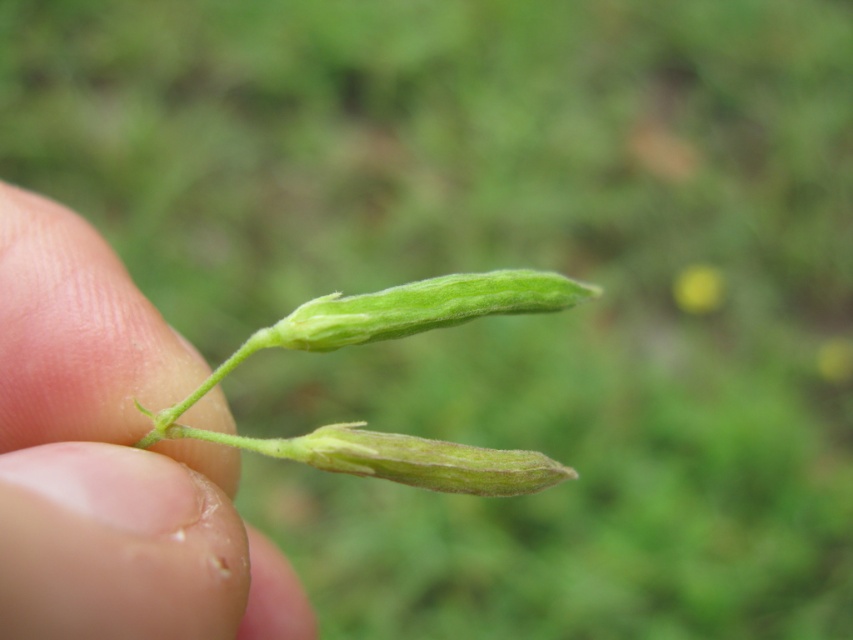
Question: Is green matte pod at center to the right of green matte pod at upper center from the viewer's perspective?

Choices:
 (A) yes
 (B) no

Answer: (B)

Question: Does green matte pod at center have a greater width compared to green matte pod at upper center?

Choices:
 (A) yes
 (B) no

Answer: (A)

Question: Among these objects, which one is nearest to the camera?

Choices:
 (A) green matte pod at upper center
 (B) green matte pod at center

Answer: (B)

Question: Does green matte pod at center have a lesser width compared to green matte pod at upper center?

Choices:
 (A) yes
 (B) no

Answer: (B)

Question: Which of the following is the farthest from the observer?

Choices:
 (A) green matte pod at center
 (B) green matte pod at upper center

Answer: (B)